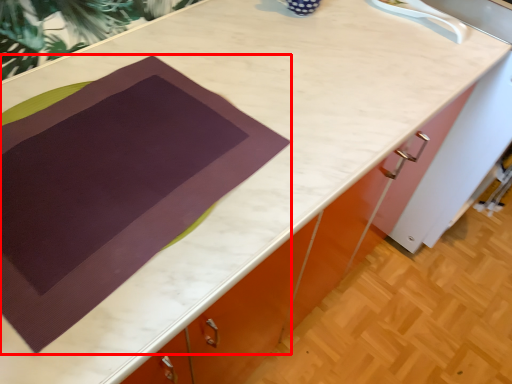
Question: From the image's perspective, where is blanket (annotated by the red box) located in relation to sink in the image?

Choices:
 (A) above
 (B) below

Answer: (B)